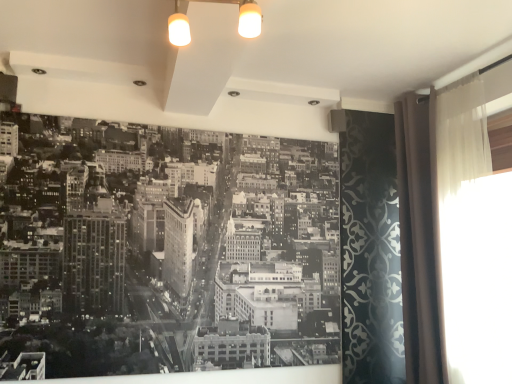
This screenshot has height=384, width=512. Describe the element at coordinates (419, 238) in the screenshot. I see `beige fabric curtain at right` at that location.

What do you see at coordinates (169, 252) in the screenshot?
I see `black paper at center` at bounding box center [169, 252].

Where is `translucent fabric curtain at right`? translucent fabric curtain at right is located at coordinates (474, 231).

Which is behind, translucent fabric curtain at right or beige fabric curtain at right?

beige fabric curtain at right.

Does translucent fabric curtain at right contain beige fabric curtain at right?

No, beige fabric curtain at right is located outside of translucent fabric curtain at right.

From the image's perspective, would you say translucent fabric curtain at right is shown under beige fabric curtain at right?

No, from the image's perspective, translucent fabric curtain at right is not below beige fabric curtain at right.

Which object is wider, translucent fabric curtain at right or beige fabric curtain at right?

Wider between the two is beige fabric curtain at right.

From the image's perspective, which one is positioned lower, black paper at center or translucent fabric curtain at right?

black paper at center.

Considering the relative sizes of black paper at center and translucent fabric curtain at right in the image provided, is black paper at center bigger than translucent fabric curtain at right?

Indeed, black paper at center has a larger size compared to translucent fabric curtain at right.

From a real-world perspective, who is located higher, black paper at center or translucent fabric curtain at right?

translucent fabric curtain at right, from a real-world perspective.

Is black paper at center aimed at translucent fabric curtain at right?

No, black paper at center is not aimed at translucent fabric curtain at right.

From a real-world perspective, between black paper at center and beige fabric curtain at right, who is vertically lower?

black paper at center, from a real-world perspective.

Identify the location of shower curtain that appears on the right of black paper at center. This screenshot has width=512, height=384. (419, 238).

Is black paper at center facing towards beige fabric curtain at right?

No, black paper at center does not turn towards beige fabric curtain at right.

Considering the relative sizes of black paper at center and beige fabric curtain at right in the image provided, is black paper at center shorter than beige fabric curtain at right?

Yes, black paper at center is shorter than beige fabric curtain at right.

From a real-world perspective, is beige fabric curtain at right over black paper at center?

Correct, in the physical world, beige fabric curtain at right is higher than black paper at center.

Looking at this image, from the image's perspective, is beige fabric curtain at right under black paper at center?

Actually, beige fabric curtain at right appears above black paper at center in the image.

Is beige fabric curtain at right thinner than black paper at center?

In fact, beige fabric curtain at right might be wider than black paper at center.

Considering the positions of points (428, 173) and (0, 306), is point (428, 173) closer to camera compared to point (0, 306)?

No.

Is translucent fabric curtain at right not within black paper at center?

translucent fabric curtain at right is positioned outside black paper at center.

From a real-world perspective, relative to black paper at center, is translucent fabric curtain at right vertically above or below?

Clearly, from a real-world perspective, translucent fabric curtain at right is above black paper at center.

From the picture: From the image's perspective, is translucent fabric curtain at right above black paper at center?

Yes, from the image's perspective, translucent fabric curtain at right is above black paper at center.

Considering the relative sizes of beige fabric curtain at right and translucent fabric curtain at right in the image provided, is beige fabric curtain at right bigger than translucent fabric curtain at right?

Indeed, beige fabric curtain at right has a larger size compared to translucent fabric curtain at right.

Based on the photo, which object is further away from the camera, beige fabric curtain at right or translucent fabric curtain at right?

beige fabric curtain at right is more distant.

Considering the relative positions of beige fabric curtain at right and translucent fabric curtain at right in the image provided, is beige fabric curtain at right to the left or to the right of translucent fabric curtain at right?

beige fabric curtain at right is positioned on translucent fabric curtain at right's left side.

Looking at this image, how far apart are beige fabric curtain at right and translucent fabric curtain at right?

A distance of 9.89 inches exists between beige fabric curtain at right and translucent fabric curtain at right.

At what (x,y) coordinates should I click in order to perform the action: click on window screen on the right of beige fabric curtain at right. Please return your answer as a coordinate pair (x, y). The height and width of the screenshot is (384, 512). Looking at the image, I should click on (474, 231).

The image size is (512, 384). In order to click on window screen in front of the black paper at center in this screenshot , I will do `click(474, 231)`.

Looking at the image, which one is located further to black paper at center, beige fabric curtain at right or translucent fabric curtain at right?

Among the two, translucent fabric curtain at right is located further to black paper at center.

From the image, which object appears to be farther from beige fabric curtain at right, black paper at center or translucent fabric curtain at right?

black paper at center is positioned further to the anchor beige fabric curtain at right.

Based on their spatial positions, is translucent fabric curtain at right or black paper at center closer to beige fabric curtain at right?

translucent fabric curtain at right.

Considering their positions, is black paper at center positioned closer to translucent fabric curtain at right than beige fabric curtain at right?

beige fabric curtain at right lies closer to translucent fabric curtain at right than the other object.

Looking at the image, which one is located closer to translucent fabric curtain at right, beige fabric curtain at right or black paper at center?

beige fabric curtain at right.

Considering their positions, is translucent fabric curtain at right positioned closer to black paper at center than beige fabric curtain at right?

beige fabric curtain at right.

Identify the location of shower curtain between black paper at center and translucent fabric curtain at right in the horizontal direction. (419, 238).